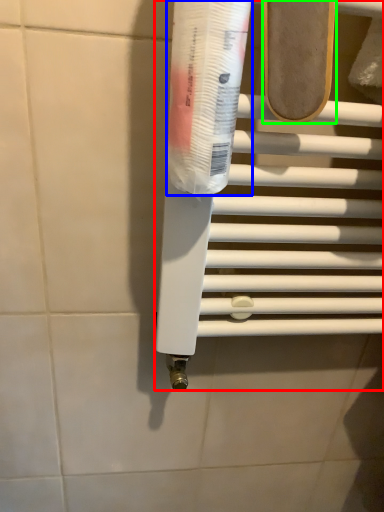
Question: Considering the real-world distances, which object is farthest from towel bar (highlighted by a red box)? toothpaste (highlighted by a blue box) or footwear (highlighted by a green box)?

Choices:
 (A) toothpaste
 (B) footwear

Answer: (B)